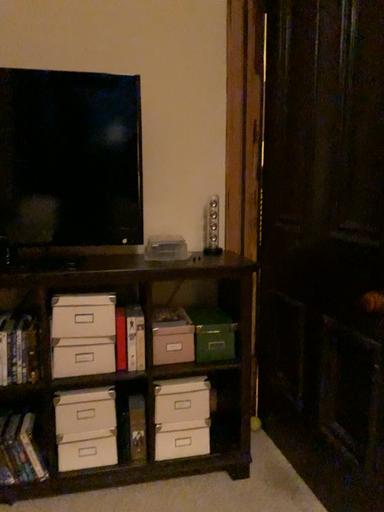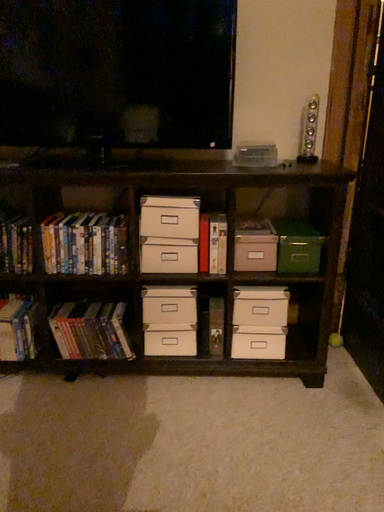
Question: Which way did the camera rotate in the video?

Choices:
 (A) rotated downward
 (B) rotated upward

Answer: (A)